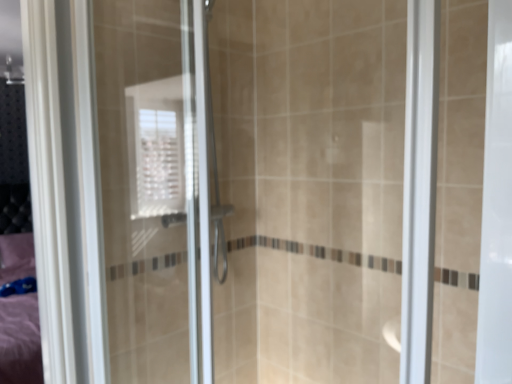
Question: Should I look upward or downward to see white textured window at upper center?

Choices:
 (A) up
 (B) down

Answer: (A)